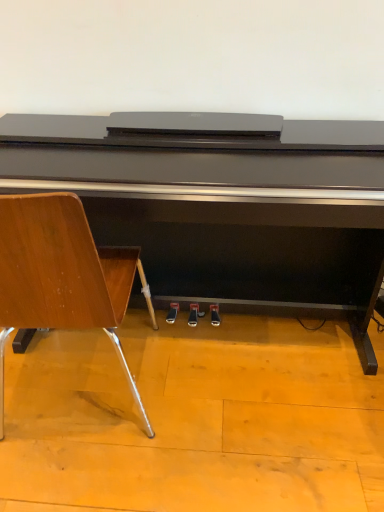
What are the coordinates of `wooden chair at left` in the screenshot? It's located at (62, 275).

Image resolution: width=384 pixels, height=512 pixels. What do you see at coordinates (62, 275) in the screenshot? I see `wooden chair at left` at bounding box center [62, 275].

What are the coordinates of `wooden chair at left` in the screenshot? It's located at (62, 275).